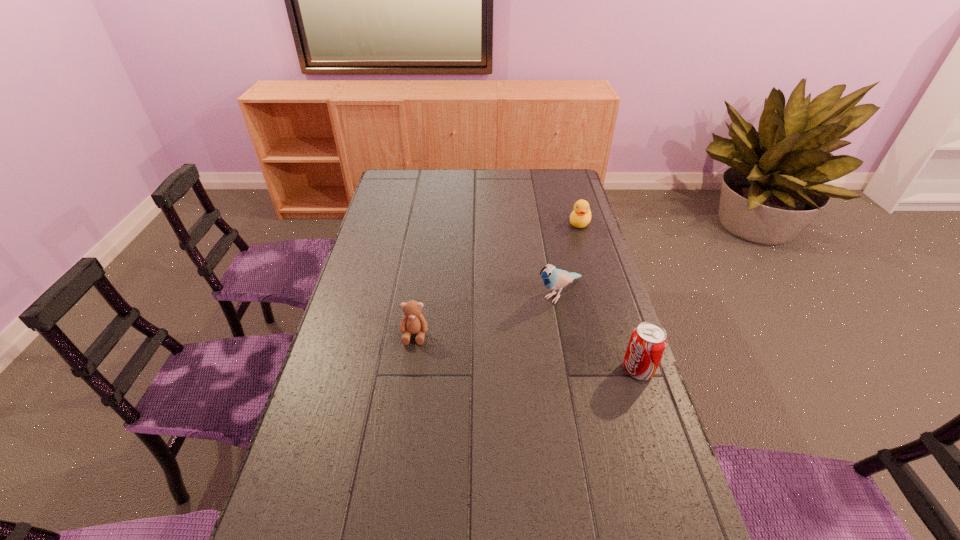
I want to click on the second nearest object, so click(x=413, y=322).

Locate an element on the screen. the leftmost object is located at coordinates (413, 322).

At what (x,y) coordinates should I click in order to perform the action: click on the nearest object. Please return your answer as a coordinate pair (x, y). Looking at the image, I should click on (647, 344).

Where is `bird`? Image resolution: width=960 pixels, height=540 pixels. bird is located at coordinates (553, 278).

At what (x,y) coordinates should I click in order to perform the action: click on the third object from right to left. Please return your answer as a coordinate pair (x, y). The width and height of the screenshot is (960, 540). Looking at the image, I should click on (553, 278).

I want to click on duckling, so click(x=580, y=217).

Locate an element on the screen. Image resolution: width=960 pixels, height=540 pixels. vacant space located on the front-facing side of the leftmost object is located at coordinates (401, 429).

Locate an element on the screen. vacant position located on the back of the nearest object is located at coordinates (613, 295).

The width and height of the screenshot is (960, 540). I want to click on vacant area located 0.200m at the face of the third object from right to left, so click(500, 339).

Where is `free space located at the face of the third object from right to left`? free space located at the face of the third object from right to left is located at coordinates (459, 372).